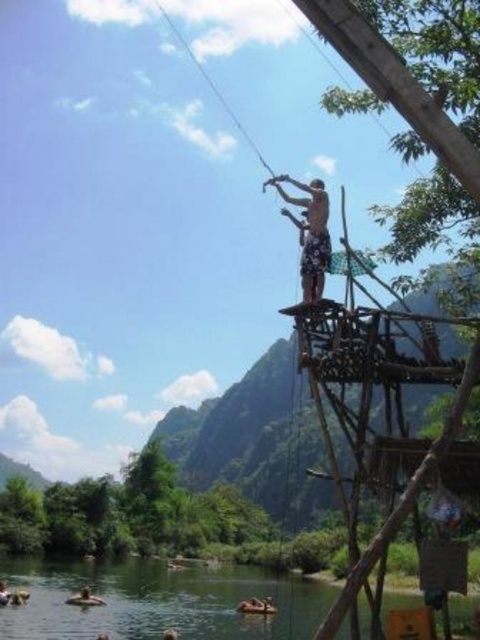
You are planning to cross a river using the brown wooden raft at lower center. From your current position on the wooden platform, which direction should you head to reach the raft?

The brown wooden raft at lower center is located at point coordinates, so you should head towards the center of the image to reach it.

You are standing at the wooden platform and see two points marked in the scene. Which point is closer to you, point (269, 600) or point (26, 595)?

Point (26, 595) is closer to you because point (269, 600) is behind it.

You are planning to place the brown leather backpack at lower left onto the brown wooden raft at lower center. Based on their sizes, will the backpack fit on the raft without any issues?

The brown wooden raft at lower center is wider than the brown leather backpack at lower left, so the backpack will fit on the raft without any issues.